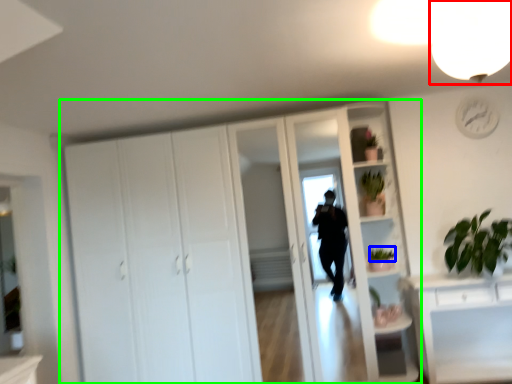
Question: Which object is positioned closest to light fixture (highlighted by a red box)? Select from plant (highlighted by a blue box) and cupboard (highlighted by a green box).

Choices:
 (A) plant
 (B) cupboard

Answer: (B)